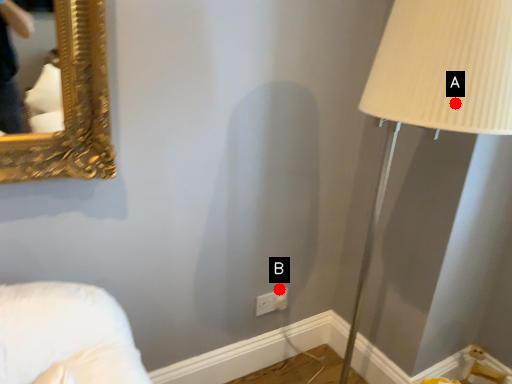
Question: Two points are circled on the image, labeled by A and B beside each circle. Which point appears farthest from the camera in this image?

Choices:
 (A) A is further
 (B) B is further

Answer: (B)